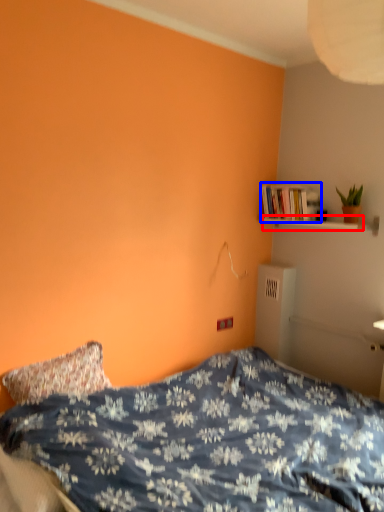
Question: Among these objects, which one is farthest to the camera, shelf (highlighted by a red box) or book (highlighted by a blue box)?

Choices:
 (A) shelf
 (B) book

Answer: (B)